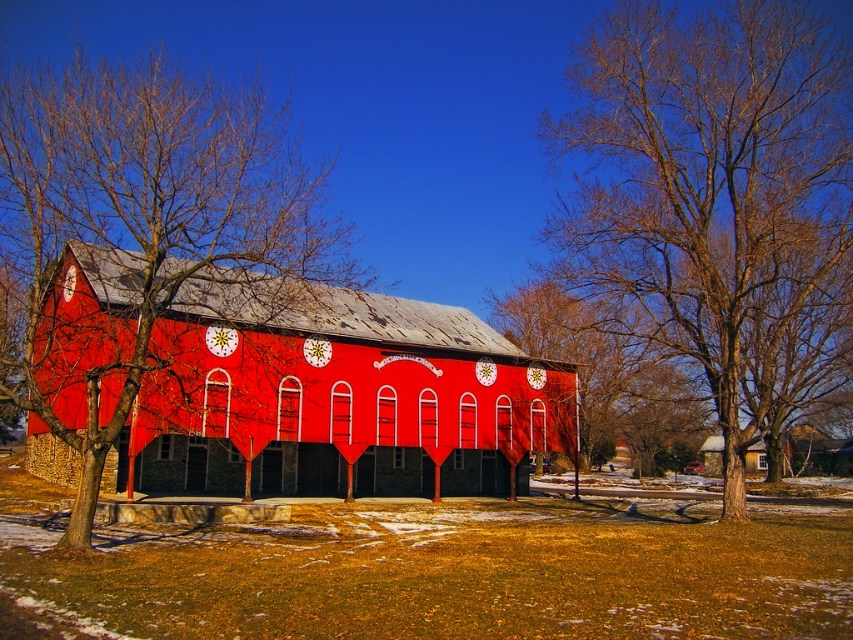
Question: Can you confirm if bare wood tree at center is positioned to the left of smooth wooden house at lower right?

Choices:
 (A) no
 (B) yes

Answer: (B)

Question: Is matte red barn at center further to the viewer compared to bare branches at left?

Choices:
 (A) no
 (B) yes

Answer: (B)

Question: Which point is closer to the camera?

Choices:
 (A) smooth wooden house at lower right
 (B) matte red barn at center

Answer: (B)

Question: Which object is positioned closest to the smooth wooden house at lower right?

Choices:
 (A) matte red barn at center
 (B) bare branches at left

Answer: (A)

Question: Is bare wood tree at center closer to the viewer compared to bare branches at left?

Choices:
 (A) no
 (B) yes

Answer: (A)

Question: Estimate the real-world distances between objects in this image. Which object is farther from the bare branches at left?

Choices:
 (A) bare wood tree at center
 (B) bare branches at center
 (C) smooth wooden house at lower right

Answer: (C)